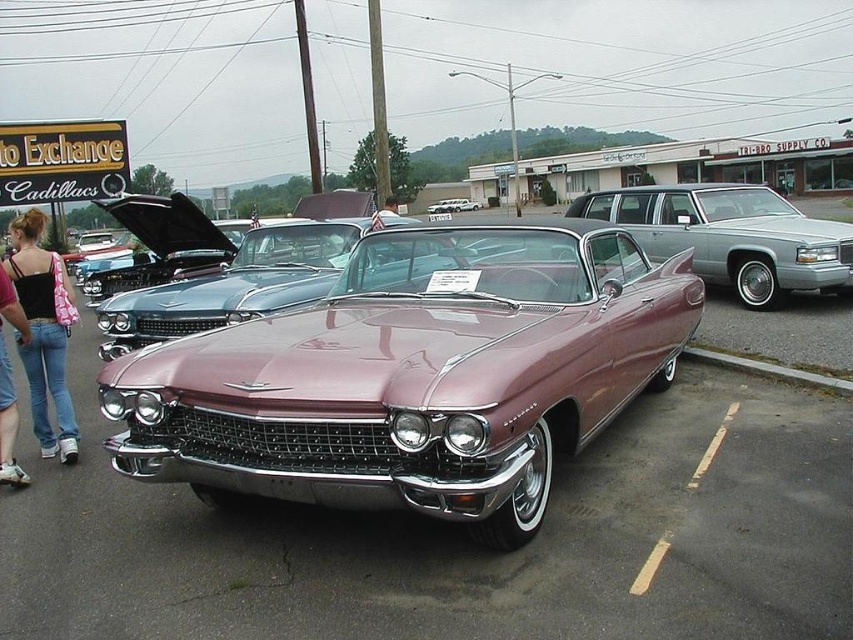
Measure the distance between shiny maroon convertible at center and camera.

The distance of shiny maroon convertible at center from camera is 3.00 meters.

Identify the location of shiny maroon convertible at center. This screenshot has height=640, width=853. (415, 374).

Which is behind, point (773, 264) or point (51, 440)?

Point (773, 264)

Is metallic silver station wagon at center closer to camera compared to pink denim jeans at lower left?

That is False.

What do you see at coordinates (730, 236) in the screenshot? I see `metallic silver station wagon at center` at bounding box center [730, 236].

The width and height of the screenshot is (853, 640). Find the location of `metallic silver station wagon at center`. metallic silver station wagon at center is located at coordinates (730, 236).

Is metallic silver station wagon at center to the left of shiny chrome convertible at center from the viewer's perspective?

No, metallic silver station wagon at center is not to the left of shiny chrome convertible at center.

Which is behind, point (733, 228) or point (456, 202)?

The point (456, 202) is more distant.

Is point (697, 246) farther from camera compared to point (465, 204)?

No, it is in front of (465, 204).

Locate an element on the screen. The image size is (853, 640). metallic silver station wagon at center is located at coordinates (730, 236).